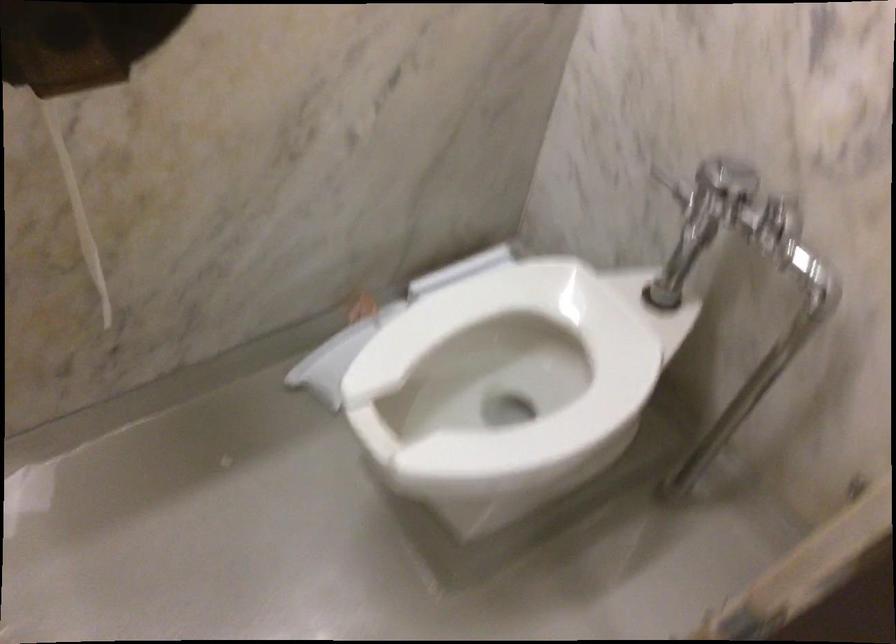
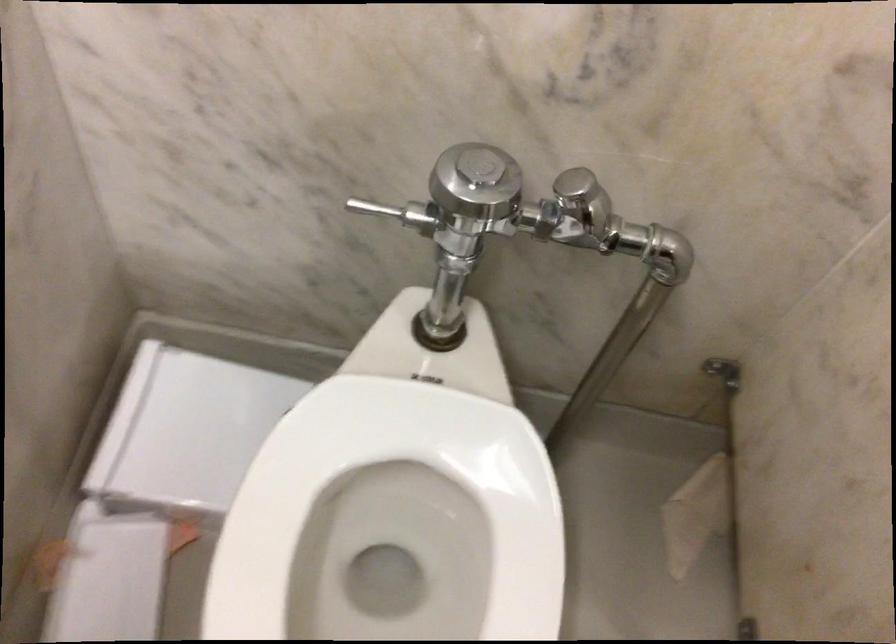
Based on the continuous images, in which direction is the camera rotating?

The rotation direction of the camera is right-down.